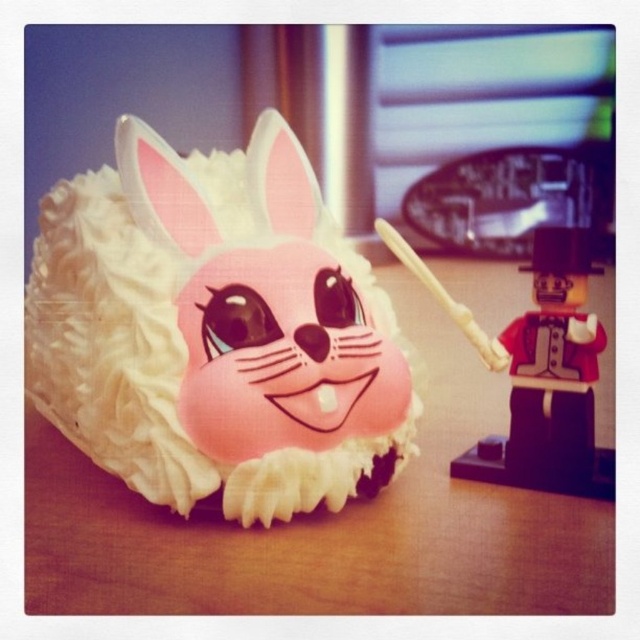
Identify the location of pink frosted cake at center. This screenshot has width=640, height=640. (216, 330).

The height and width of the screenshot is (640, 640). What do you see at coordinates (216, 330) in the screenshot?
I see `pink frosted cake at center` at bounding box center [216, 330].

Which is behind, point (125, 225) or point (595, 467)?

Positioned behind is point (595, 467).

Locate an element on the screen. pink frosted cake at center is located at coordinates (216, 330).